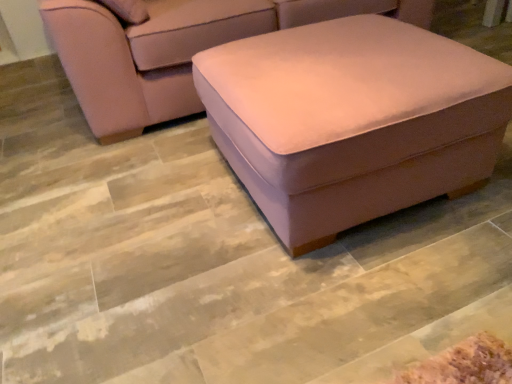
What is the approximate height of suede-like pink ottoman at center?

suede-like pink ottoman at center is 18.44 inches tall.

This screenshot has width=512, height=384. What do you see at coordinates (352, 120) in the screenshot?
I see `suede-like pink ottoman at center` at bounding box center [352, 120].

Image resolution: width=512 pixels, height=384 pixels. I want to click on suede-like pink ottoman at center, so click(352, 120).

The height and width of the screenshot is (384, 512). What do you see at coordinates (173, 50) in the screenshot? I see `suede-like beige ottoman at center` at bounding box center [173, 50].

In order to face suede-like beige ottoman at center, should I rotate leftwards or rightwards?

A 2.506 degree turn to the left will do.

I want to click on suede-like beige ottoman at center, so click(173, 50).

At what (x,y) coordinates should I click in order to perform the action: click on suede-like pink ottoman at center. Please return your answer as a coordinate pair (x, y). The width and height of the screenshot is (512, 384). Looking at the image, I should click on (352, 120).

Based on their positions, is suede-like beige ottoman at center located to the left or right of suede-like pink ottoman at center?

suede-like beige ottoman at center is to the left of suede-like pink ottoman at center.

Which object is closer to the camera, suede-like beige ottoman at center or suede-like pink ottoman at center?

suede-like pink ottoman at center.

Which is in front, point (349, 11) or point (321, 86)?

The point (321, 86) is in front.

From the image's perspective, is suede-like beige ottoman at center beneath suede-like pink ottoman at center?

No, from the image's perspective, suede-like beige ottoman at center is not beneath suede-like pink ottoman at center.

From a real-world perspective, is suede-like beige ottoman at center below suede-like pink ottoman at center?

No.

Looking at their sizes, would you say suede-like beige ottoman at center is wider or thinner than suede-like pink ottoman at center?

Considering their sizes, suede-like beige ottoman at center looks broader than suede-like pink ottoman at center.

Considering the relative sizes of suede-like beige ottoman at center and suede-like pink ottoman at center in the image provided, is suede-like beige ottoman at center shorter than suede-like pink ottoman at center?

Incorrect, the height of suede-like beige ottoman at center does not fall short of that of suede-like pink ottoman at center.

Is suede-like beige ottoman at center smaller than suede-like pink ottoman at center?

No, suede-like beige ottoman at center is not smaller than suede-like pink ottoman at center.

Is suede-like pink ottoman at center located within suede-like beige ottoman at center?

No, suede-like pink ottoman at center is located outside of suede-like beige ottoman at center.

Would you say suede-like beige ottoman at center is a long distance from suede-like pink ottoman at center?

No.

Is suede-like beige ottoman at center aimed at suede-like pink ottoman at center?

Yes, suede-like beige ottoman at center is facing suede-like pink ottoman at center.

Measure the distance from suede-like beige ottoman at center to suede-like pink ottoman at center.

The distance of suede-like beige ottoman at center from suede-like pink ottoman at center is 28.08 inches.

This screenshot has width=512, height=384. I want to click on studio couch behind the suede-like pink ottoman at center, so click(x=173, y=50).

Which object is positioned more to the left, suede-like pink ottoman at center or suede-like beige ottoman at center?

From the viewer's perspective, suede-like beige ottoman at center appears more on the left side.

Who is more distant, suede-like pink ottoman at center or suede-like beige ottoman at center?

Positioned behind is suede-like beige ottoman at center.

Is point (354, 32) positioned in front of point (228, 14)?

Yes, it is.

From the image's perspective, which one is positioned lower, suede-like pink ottoman at center or suede-like beige ottoman at center?

suede-like pink ottoman at center.

From a real-world perspective, between suede-like pink ottoman at center and suede-like beige ottoman at center, who is vertically lower?

suede-like pink ottoman at center, from a real-world perspective.

Considering the relative sizes of suede-like pink ottoman at center and suede-like beige ottoman at center in the image provided, is suede-like pink ottoman at center thinner than suede-like beige ottoman at center?

Yes.

Is suede-like pink ottoman at center taller or shorter than suede-like beige ottoman at center?

Considering their sizes, suede-like pink ottoman at center has less height than suede-like beige ottoman at center.

Considering the relative sizes of suede-like pink ottoman at center and suede-like beige ottoman at center in the image provided, is suede-like pink ottoman at center smaller than suede-like beige ottoman at center?

Correct, suede-like pink ottoman at center occupies less space than suede-like beige ottoman at center.

Is suede-like beige ottoman at center located within suede-like pink ottoman at center?

No.

In the scene shown: Is suede-like pink ottoman at center with suede-like beige ottoman at center?

They are not placed beside each other.

Based on the photo, is suede-like pink ottoman at center facing away from suede-like beige ottoman at center?

Absolutely, suede-like pink ottoman at center is directed away from suede-like beige ottoman at center.

What's the angular difference between suede-like pink ottoman at center and suede-like beige ottoman at center's facing directions?

The facing directions of suede-like pink ottoman at center and suede-like beige ottoman at center are 0.000331 degrees apart.

You are a GUI agent. You are given a task and a screenshot of the screen. Output one action in this format:
    pyautogui.click(x=<x>, y=<y>)
    Task: Click on the stool in front of the suede-like beige ottoman at center
    Image resolution: width=512 pixels, height=384 pixels.
    Given the screenshot: What is the action you would take?
    pyautogui.click(x=352, y=120)

The height and width of the screenshot is (384, 512). I want to click on studio couch to the left of suede-like pink ottoman at center, so click(173, 50).

This screenshot has width=512, height=384. In order to click on stool below the suede-like beige ottoman at center (from the image's perspective) in this screenshot , I will do `click(352, 120)`.